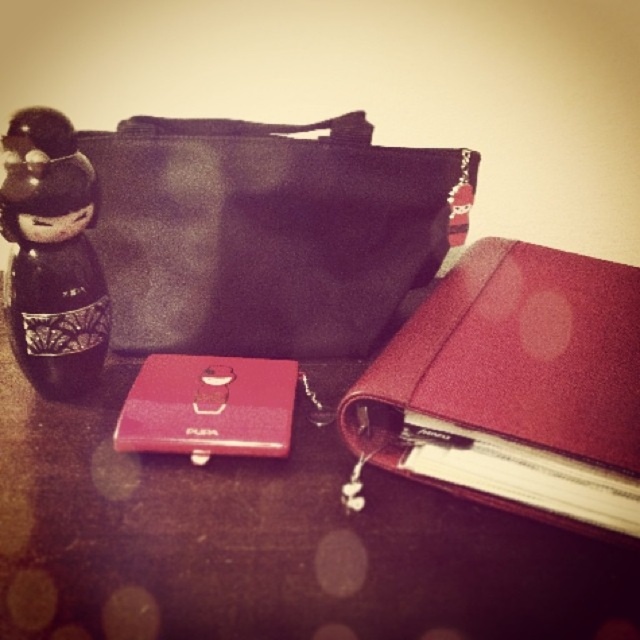
Based on the photo, does satin burgundy binder at center have a greater width compared to black glossy figurine at left?

Correct, the width of satin burgundy binder at center exceeds that of black glossy figurine at left.

Which of these two, satin burgundy binder at center or black glossy figurine at left, stands taller?

satin burgundy binder at center is taller.

Where is `satin burgundy binder at center`? satin burgundy binder at center is located at coordinates (515, 387).

Locate an element on the screen. Image resolution: width=640 pixels, height=640 pixels. satin burgundy binder at center is located at coordinates (515, 387).

Is black fabric bag at upper left to the right of black glossy figurine at left from the viewer's perspective?

Yes, black fabric bag at upper left is to the right of black glossy figurine at left.

Which of these two, black fabric bag at upper left or black glossy figurine at left, stands taller?

black fabric bag at upper left

Which is behind, point (419, 268) or point (49, 176)?

Positioned behind is point (419, 268).

The width and height of the screenshot is (640, 640). Identify the location of black fabric bag at upper left. (268, 232).

This screenshot has width=640, height=640. Describe the element at coordinates (268, 232) in the screenshot. I see `black fabric bag at upper left` at that location.

Locate an element on the screen. black fabric bag at upper left is located at coordinates (268, 232).

Between point (134, 305) and point (401, 461), which one is positioned behind?

The point (134, 305) is more distant.

At what (x,y) coordinates should I click in order to perform the action: click on black fabric bag at upper left. Please return your answer as a coordinate pair (x, y). The width and height of the screenshot is (640, 640). Looking at the image, I should click on (268, 232).